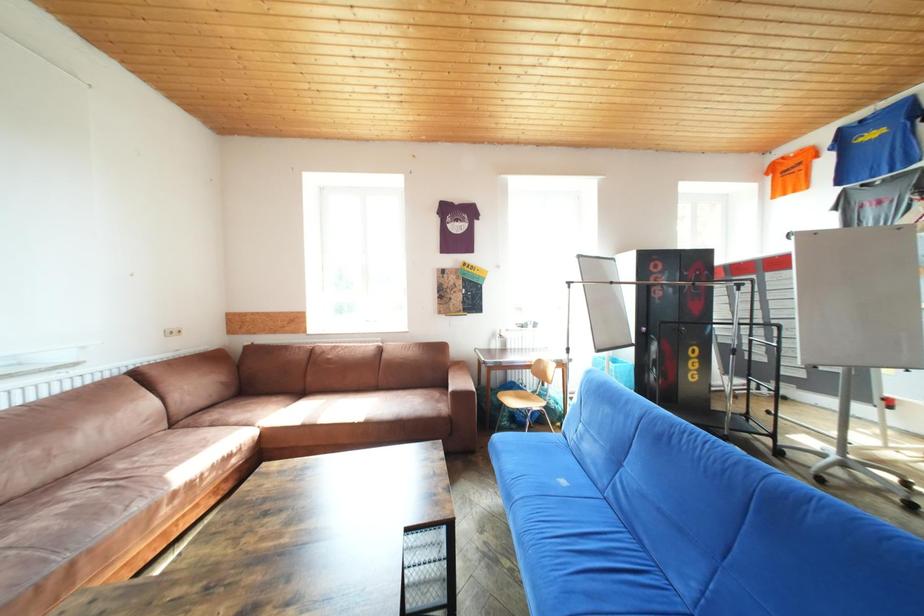
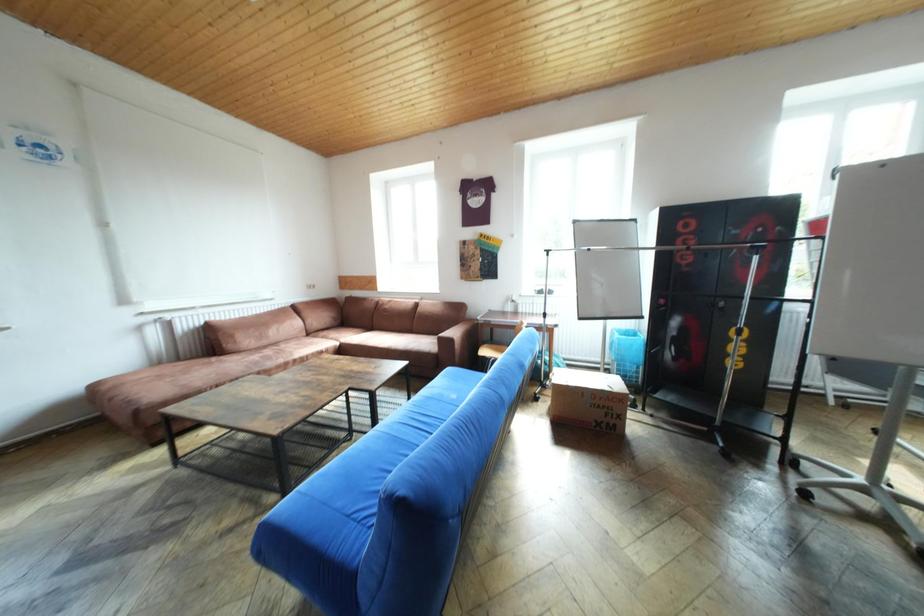
Question: Which direction would the cameraman need to move to produce the second image? Reply with the corresponding letter.

Choices:
 (A) Left
 (B) Right
 (C) Forward
 (D) Backward

Answer: (B)